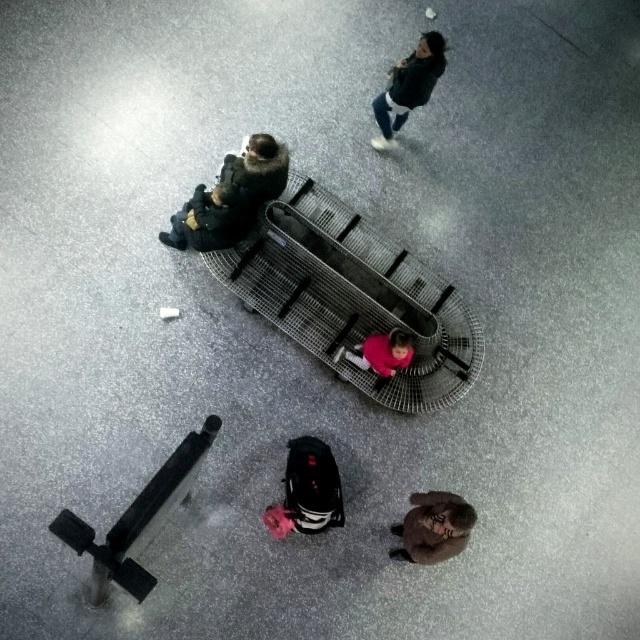
Can you confirm if brown fuzzy coat at lower right is shorter than pink matte jacket at center?

Incorrect, brown fuzzy coat at lower right's height does not fall short of pink matte jacket at center's.

Does brown fuzzy coat at lower right have a lesser width compared to pink matte jacket at center?

Yes, brown fuzzy coat at lower right is thinner than pink matte jacket at center.

Where is `brown fuzzy coat at lower right`? brown fuzzy coat at lower right is located at coordinates (433, 528).

Who is more forward, (384, 124) or (388, 365)?

Point (388, 365) is in front.

Who is shorter, dark green jacket at upper center or pink matte jacket at center?

pink matte jacket at center

Does point (419, 58) come behind point (368, 339)?

Yes, it is behind point (368, 339).

The image size is (640, 640). What are the coordinates of `dark green jacket at upper center` in the screenshot? It's located at (408, 86).

Does dark gray fabric jacket at upper left appear under black fabric suitcase at center?

Actually, dark gray fabric jacket at upper left is above black fabric suitcase at center.

You are a GUI agent. You are given a task and a screenshot of the screen. Output one action in this format:
    pyautogui.click(x=<x>, y=<y>)
    Task: Click on the dark gray fabric jacket at upper left
    The width and height of the screenshot is (640, 640).
    Given the screenshot: What is the action you would take?
    pyautogui.click(x=230, y=196)

This screenshot has height=640, width=640. In order to click on dark gray fabric jacket at upper left in this screenshot , I will do `click(230, 196)`.